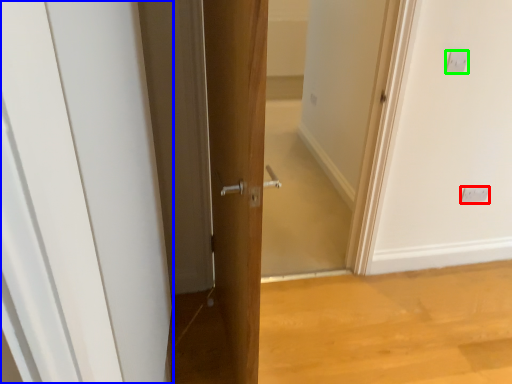
Question: Which is farther away from electric outlet (highlighted by a red box)? door (highlighted by a blue box) or electric outlet (highlighted by a green box)?

Choices:
 (A) door
 (B) electric outlet

Answer: (A)